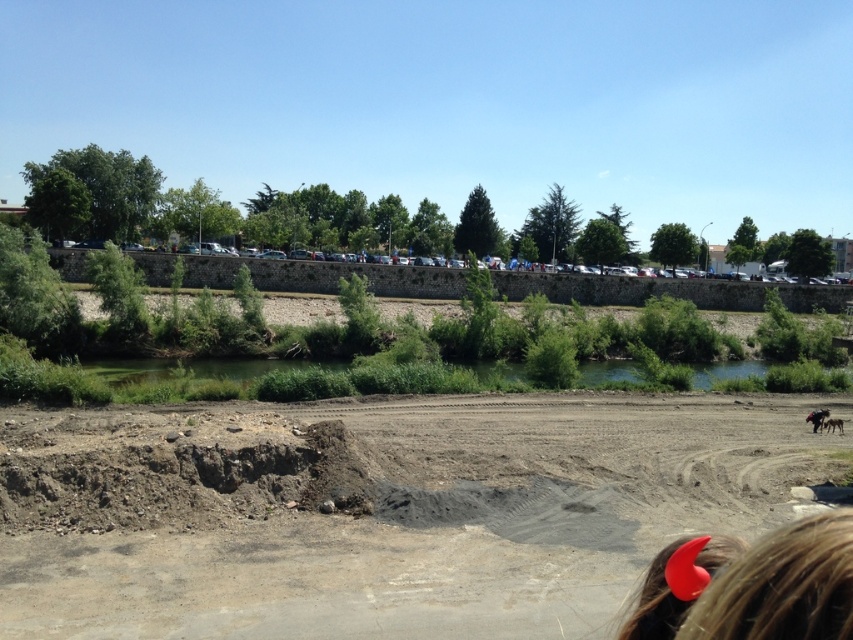
You are a drone operator who needs to capture aerial footage of the brown sandy dirt field at center and the green grassy river at center. Based on the scene, which object is positioned higher in elevation?

The brown sandy dirt field at center is located above the green grassy river at center, so it has a higher elevation.

You are standing at the edge of the brown sandy dirt field at center. You want to walk to the green grassy river at center. Which direction should you move to get closer to the river?

Since the brown sandy dirt field at center is closer to the viewer than the green grassy river at center, you should move forward to get closer to the river.